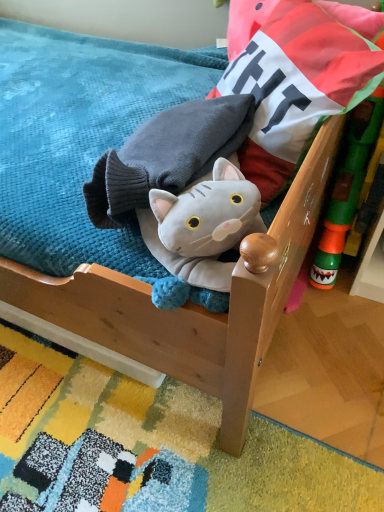
Question: Considering the relative sizes of soft blue fabric at upper left and green plastic toy at right in the image provided, is soft blue fabric at upper left wider than green plastic toy at right?

Choices:
 (A) yes
 (B) no

Answer: (A)

Question: Is soft blue fabric at upper left turned away from green plastic toy at right?

Choices:
 (A) yes
 (B) no

Answer: (B)

Question: From the image's perspective, is soft blue fabric at upper left below green plastic toy at right?

Choices:
 (A) yes
 (B) no

Answer: (B)

Question: Is soft blue fabric at upper left positioned far away from green plastic toy at right?

Choices:
 (A) yes
 (B) no

Answer: (B)

Question: Is soft blue fabric at upper left at the left side of green plastic toy at right?

Choices:
 (A) yes
 (B) no

Answer: (A)

Question: From a real-world perspective, relative to velvet cushion at upper right, is soft blue fabric at upper left vertically above or below?

Choices:
 (A) below
 (B) above

Answer: (A)

Question: From the image's perspective, is soft blue fabric at upper left positioned above or below velvet cushion at upper right?

Choices:
 (A) below
 (B) above

Answer: (A)

Question: Considering the positions of soft blue fabric at upper left and velvet cushion at upper right in the image, is soft blue fabric at upper left taller or shorter than velvet cushion at upper right?

Choices:
 (A) tall
 (B) short

Answer: (B)

Question: Considering the relative positions of soft blue fabric at upper left and velvet cushion at upper right in the image provided, is soft blue fabric at upper left to the left or to the right of velvet cushion at upper right?

Choices:
 (A) right
 (B) left

Answer: (B)

Question: From a real-world perspective, is velvet cushion at upper right positioned above or below soft blue fabric at upper left?

Choices:
 (A) below
 (B) above

Answer: (B)

Question: Is point (251, 35) closer or farther from the camera than point (51, 123)?

Choices:
 (A) farther
 (B) closer

Answer: (B)

Question: Would you say velvet cushion at upper right is to the left or to the right of soft blue fabric at upper left in the picture?

Choices:
 (A) right
 (B) left

Answer: (A)

Question: Is velvet cushion at upper right wider or thinner than soft blue fabric at upper left?

Choices:
 (A) thin
 (B) wide

Answer: (B)

Question: In the image, is soft blue fabric at upper left on the left side or the right side of green plastic toy at right?

Choices:
 (A) left
 (B) right

Answer: (A)

Question: Looking at the image, does soft blue fabric at upper left seem bigger or smaller compared to green plastic toy at right?

Choices:
 (A) small
 (B) big

Answer: (B)